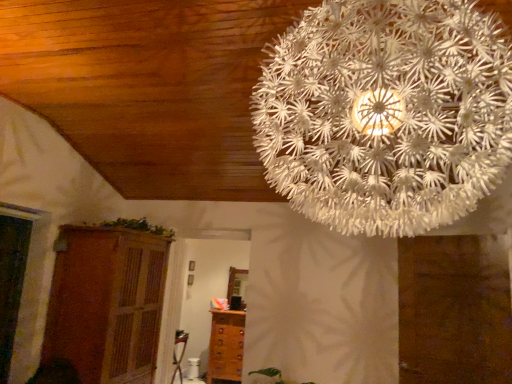
Question: Visually, is white paper-like at upper center positioned to the left or to the right of green leafy plant at upper center?

Choices:
 (A) left
 (B) right

Answer: (B)

Question: Considering the positions of point (450, 102) and point (168, 230), is point (450, 102) closer or farther from the camera than point (168, 230)?

Choices:
 (A) farther
 (B) closer

Answer: (B)

Question: Which object is positioned farthest from the green leafy plant at upper center?

Choices:
 (A) wooden cupboard at lower left
 (B) brown wooden chest of drawers at lower center
 (C) white paper-like at upper center

Answer: (C)

Question: Estimate the real-world distances between objects in this image. Which object is closer to the green leafy plant at upper center?

Choices:
 (A) wooden cupboard at lower left
 (B) white paper-like at upper center
 (C) brown wooden chest of drawers at lower center

Answer: (A)